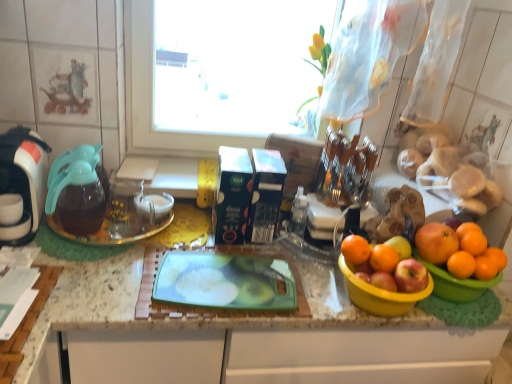
Image resolution: width=512 pixels, height=384 pixels. Identify the location of vacant space to the left of yellow plastic bowl at right, which is counted as the 2th basin, starting from the right. (311, 289).